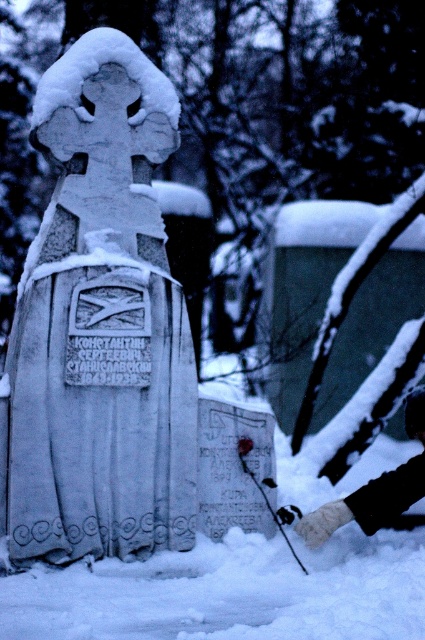
Question: Which of the following is the farthest from the observer?

Choices:
 (A) fuzzy woolen glove at lower right
 (B) white stone cross at center

Answer: (A)

Question: Where is white stone cross at center located in relation to fuzzy woolen glove at lower right in the image?

Choices:
 (A) left
 (B) right

Answer: (A)

Question: Is white stone cross at center thinner than fuzzy woolen glove at lower right?

Choices:
 (A) yes
 (B) no

Answer: (B)

Question: Which point is farther from the camera taking this photo?

Choices:
 (A) (424, 396)
 (B) (155, 513)

Answer: (A)

Question: Can you confirm if white stone cross at center is thinner than fuzzy woolen glove at lower right?

Choices:
 (A) yes
 (B) no

Answer: (B)